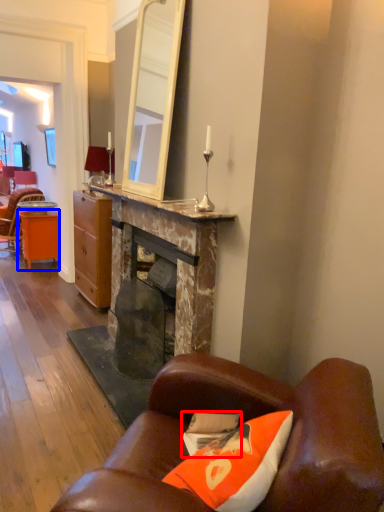
Question: Which object appears closest to the camera in this image, pillow (highlighted by a red box) or desk (highlighted by a blue box)?

Choices:
 (A) pillow
 (B) desk

Answer: (A)